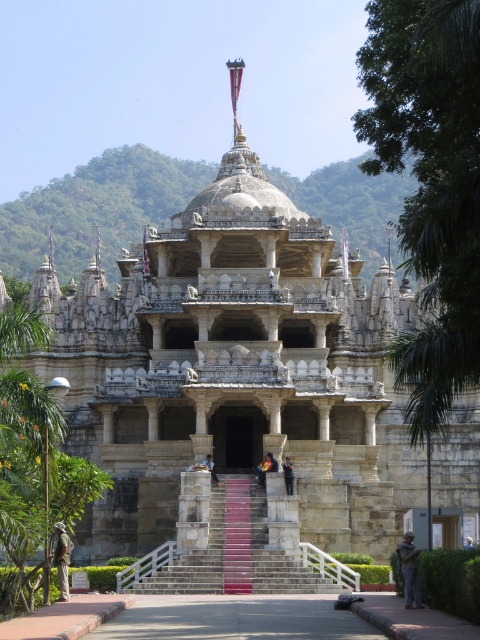
You are standing at the base of the temple staircase and want to take a photo. There are two points marked on the temple structure at coordinates point (x=280, y=573) and point (x=287, y=492). Which point would appear larger in your camera view?

Point (x=280, y=573) is closer to the camera than point (x=287, y=492), so it would appear larger in the camera view.

You are standing at the base of the temple stairs and want to reach the golden finial on the temple roof. The point at coordinates (256, 520) is part of the temple structure. Considering the distance from your current position to this point, can you estimate whether you would need to climb more than 100 meters to reach the golden finial?

The distance from your current position to the point at (256, 520) is 88.65 meters. Since this distance is less than 100 meters, you would not need to climb more than 100 meters to reach the golden finial.